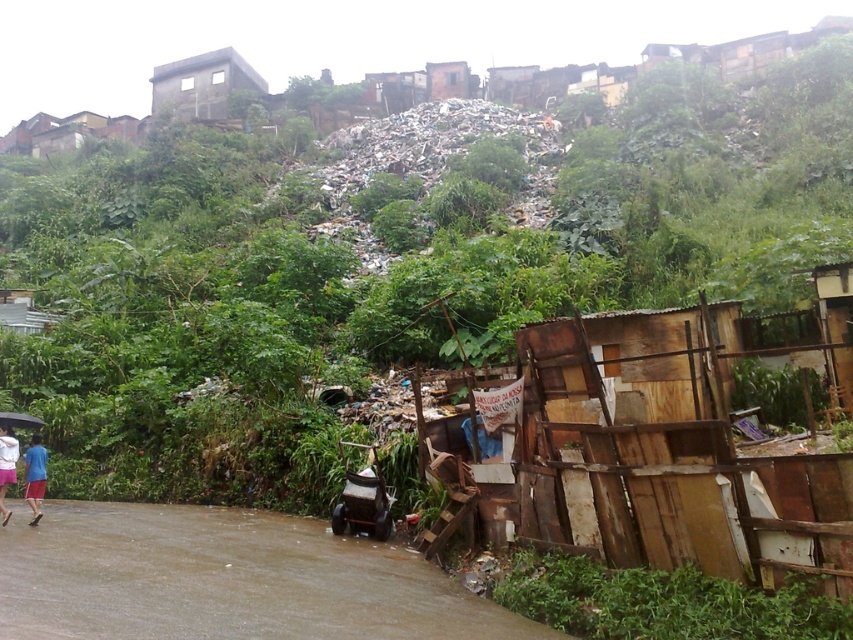
Which is in front, point (437, 90) or point (27, 492)?

Positioned in front is point (27, 492).

Can you confirm if brown corrugated metal hut at upper center is thinner than blue fabric shorts at lower left?

No.

Locate an element on the screen. The image size is (853, 640). brown corrugated metal hut at upper center is located at coordinates (450, 81).

Locate an element on the screen. The width and height of the screenshot is (853, 640). brown corrugated metal hut at upper center is located at coordinates (450, 81).

Based on the photo, does blue fabric shorts at lower left have a larger size compared to transparent plastic umbrella at lower left?

Correct, blue fabric shorts at lower left is larger in size than transparent plastic umbrella at lower left.

Looking at this image, is blue fabric shorts at lower left smaller than transparent plastic umbrella at lower left?

No.

Which is behind, point (32, 476) or point (9, 429)?

The point (9, 429) is behind.

The image size is (853, 640). What are the coordinates of `blue fabric shorts at lower left` in the screenshot? It's located at (33, 476).

Which is above, blue fabric umbrella at lower left or transparent plastic umbrella at lower left?

transparent plastic umbrella at lower left is higher up.

Where is `blue fabric umbrella at lower left`? blue fabric umbrella at lower left is located at coordinates (6, 467).

What do you see at coordinates (6, 467) in the screenshot? I see `blue fabric umbrella at lower left` at bounding box center [6, 467].

Identify the location of blue fabric umbrella at lower left. (6, 467).